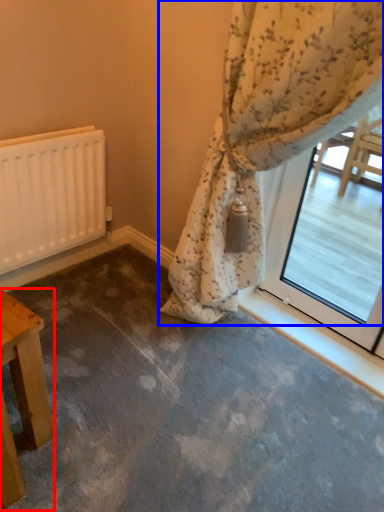
Question: Which of the following is the closest to the observer, table (highlighted by a red box) or curtain (highlighted by a blue box)?

Choices:
 (A) table
 (B) curtain

Answer: (B)